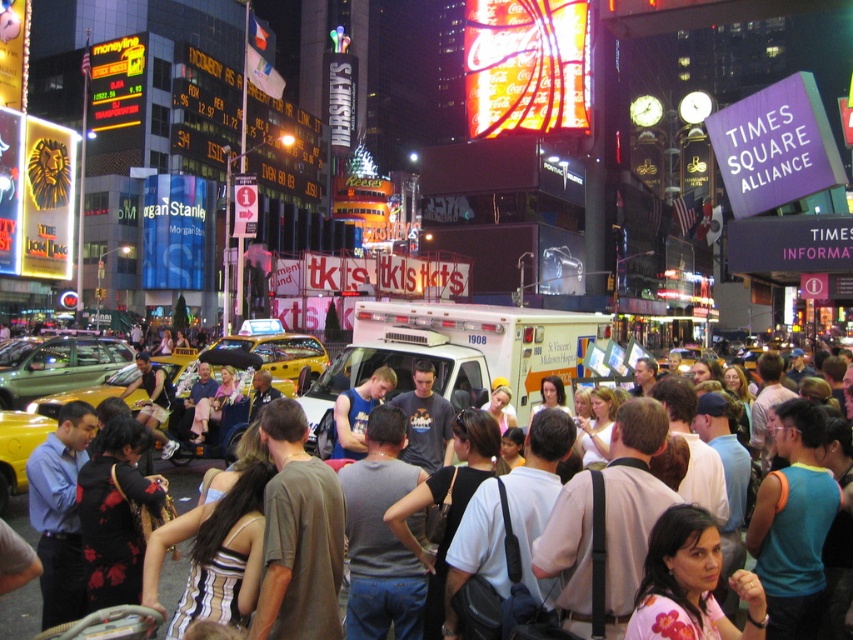
Can you confirm if neon glass coca-cola sign at upper center is bigger than white cotton shirt at center?

No, neon glass coca-cola sign at upper center is not bigger than white cotton shirt at center.

Is point (525, 54) positioned in front of point (183, 556)?

No, (525, 54) is further to viewer.

This screenshot has height=640, width=853. I want to click on neon glass coca-cola sign at upper center, so click(526, 65).

Who is more forward, (523, 374) or (265, 333)?

Positioned in front is point (523, 374).

Is point (561, 353) positioned in front of point (281, 328)?

Yes, it is.

Is point (578, 362) positioned in front of point (260, 348)?

Yes, point (578, 362) is closer to viewer.

Locate an element on the screen. This screenshot has height=640, width=853. white matte ambulance at center is located at coordinates (461, 352).

Does white matte ambulance at center lie in front of neon glass coca-cola sign at upper center?

Yes, white matte ambulance at center is in front of neon glass coca-cola sign at upper center.

Find the location of a particular element. white matte ambulance at center is located at coordinates (461, 352).

Locate an element on the screen. The height and width of the screenshot is (640, 853). white matte ambulance at center is located at coordinates (461, 352).